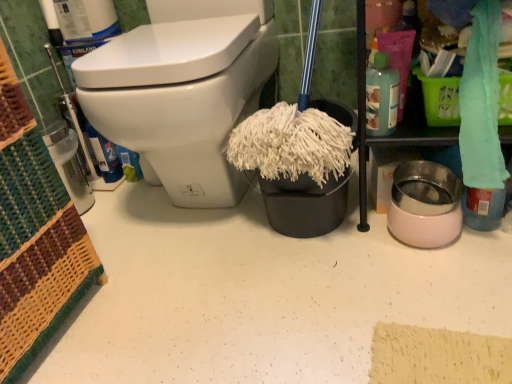
At what (x,y) coordinates should I click in order to perform the action: click on free space in front of white fluffy mop head at center. Please return your answer as a coordinate pair (x, y). Looking at the image, I should click on (328, 282).